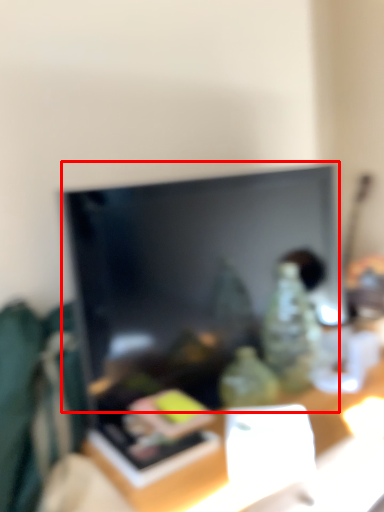
Question: Where is television (annotated by the red box) located in relation to table in the image?

Choices:
 (A) left
 (B) right

Answer: (A)